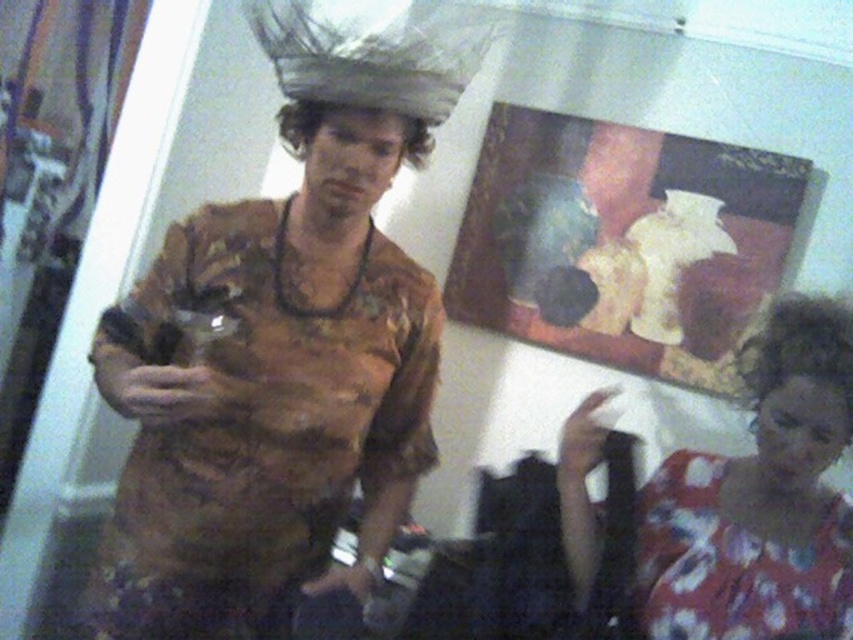
Does curly brown hair at lower right appear under shiny metallic headband at center?

Correct, curly brown hair at lower right is located below shiny metallic headband at center.

Does point (762, 388) come in front of point (287, 116)?

No.

Does point (824, 326) come behind point (384, 118)?

That is True.

Where is `curly brown hair at lower right`? The width and height of the screenshot is (853, 640). curly brown hair at lower right is located at coordinates pos(799,378).

Between point (308, 230) and point (843, 310), which one is positioned in front?

Point (843, 310)

Does point (276, 234) lie behind point (805, 332)?

Yes, point (276, 234) is farther from viewer.

Find the location of a particular element. matte brown shirt at center is located at coordinates (274, 374).

Locate an element on the screen. The height and width of the screenshot is (640, 853). matte brown shirt at center is located at coordinates (274, 374).

Is floral fabric blouse at lower right positioned behind curly brown hair at lower right?

Yes, floral fabric blouse at lower right is further from the viewer.

Is floral fabric blouse at lower right to the left of curly brown hair at lower right from the viewer's perspective?

Correct, you'll find floral fabric blouse at lower right to the left of curly brown hair at lower right.

Which is behind, point (762, 429) or point (838, 305)?

The point (838, 305) is behind.

This screenshot has height=640, width=853. I want to click on floral fabric blouse at lower right, so click(759, 497).